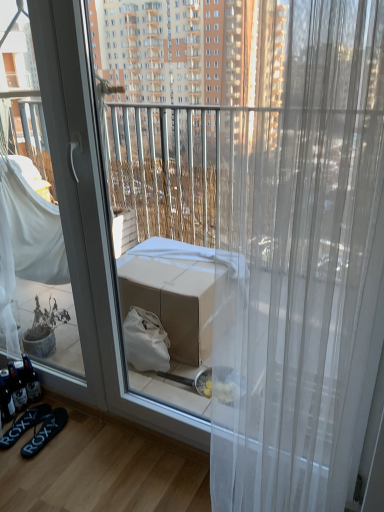
Question: From the image's perspective, is black rubber flip-flops at lower left, the first footwear when ordered from right to left, positioned above or below transparent sheer curtain at center?

Choices:
 (A) below
 (B) above

Answer: (A)

Question: Considering the relative positions of black rubber flip-flops at lower left, which appears as the 2th footwear when viewed from the left, and transparent sheer curtain at center in the image provided, is black rubber flip-flops at lower left, which appears as the 2th footwear when viewed from the left, to the left or to the right of transparent sheer curtain at center?

Choices:
 (A) left
 (B) right

Answer: (A)

Question: Based on their relative distances, which object is nearer to the transparent sheer curtain at center?

Choices:
 (A) black fabric flip-flops at lower left, the 2th footwear in the right-to-left sequence
 (B) black rubber flip-flops at lower left, which appears as the 2th footwear when viewed from the left

Answer: (B)

Question: Which is nearer to the black rubber flip-flops at lower left, which appears as the 2th footwear when viewed from the left?

Choices:
 (A) transparent sheer curtain at center
 (B) black fabric flip-flops at lower left, the 2th footwear in the right-to-left sequence

Answer: (B)